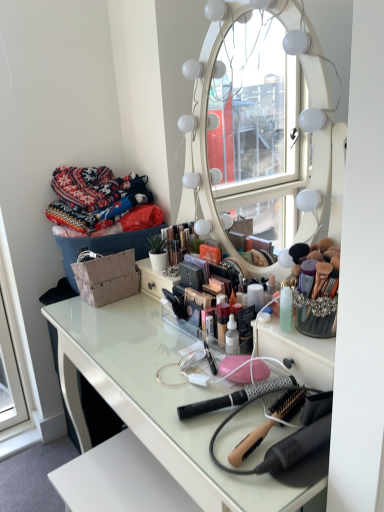
Identify the location of free space that is in between black plastic brush at center, the 1th brush when ordered from back to front, and wooden-handled hairbrush at center, which is the 1th brush in front-to-back order. (221, 425).